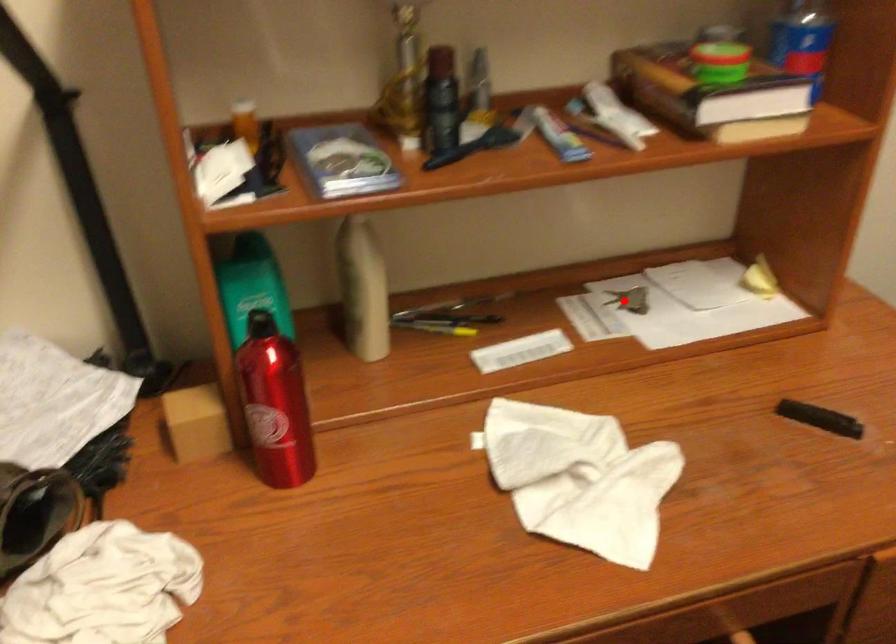
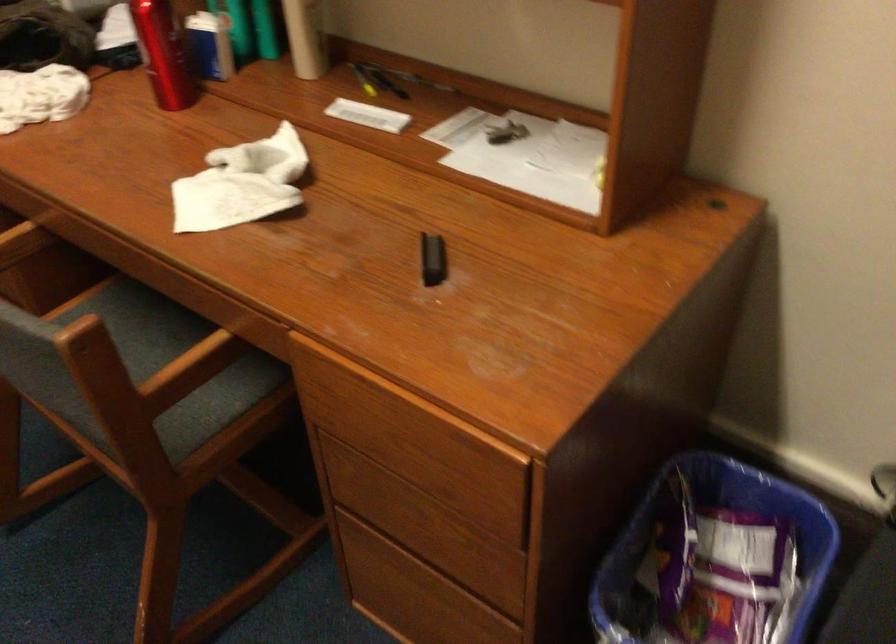
Locate, in the second image, the point that corresponds to the highlighted location in the first image.

(504, 131)